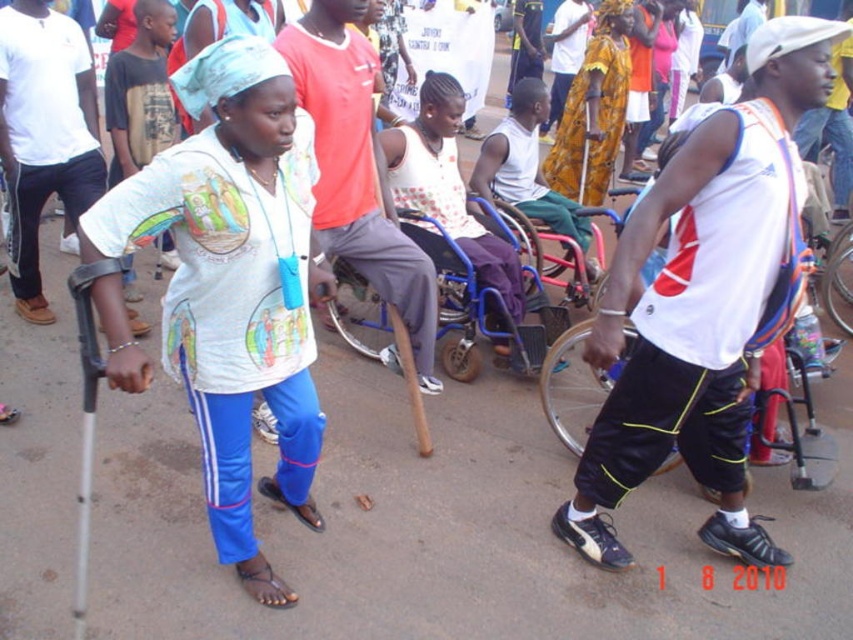
Question: Does blue plastic wheelchair at center have a larger size compared to white matte wheelchair at center?

Choices:
 (A) no
 (B) yes

Answer: (B)

Question: Which is nearer to the white matte shirt at left?

Choices:
 (A) silver metallic wheelchair at right
 (B) wooden cane at center
 (C) blue plastic wheelchair at center

Answer: (B)

Question: Which point is closer to the camera?

Choices:
 (A) blue plastic wheelchair at center
 (B) wooden cane at center
 (C) silver metallic wheelchair at right
 (D) white matte wheelchair at center

Answer: (C)

Question: Can you confirm if wooden cane at center is positioned below white matte wheelchair at center?

Choices:
 (A) no
 (B) yes

Answer: (B)

Question: Considering the relative positions of blue plastic wheelchair at center and white matte wheelchair at center in the image provided, where is blue plastic wheelchair at center located with respect to white matte wheelchair at center?

Choices:
 (A) below
 (B) above

Answer: (A)

Question: Which point appears farthest from the camera in this image?

Choices:
 (A) (537, 124)
 (B) (376, 312)
 (C) (289, 88)
 (D) (550, 356)

Answer: (A)